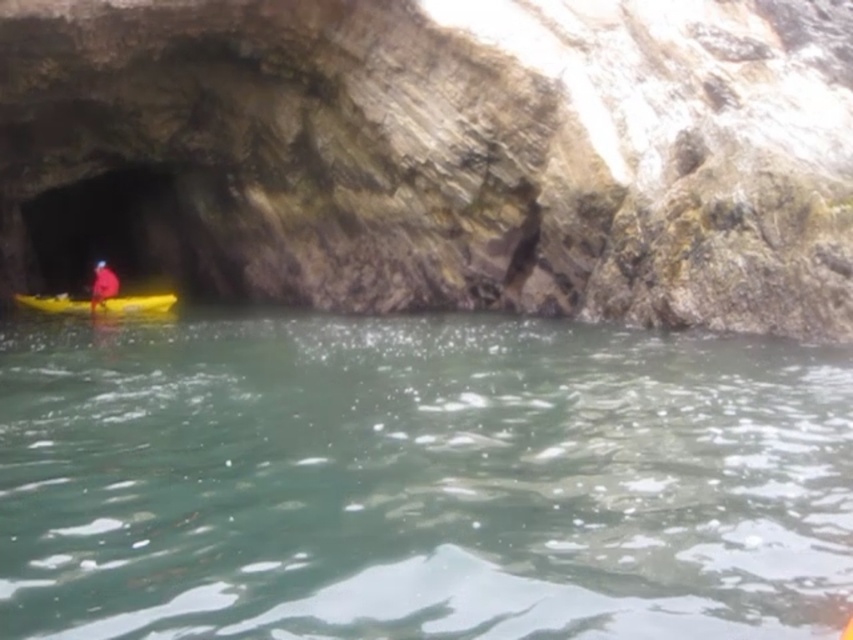
Can you confirm if rough stone cave at left is bigger than red fabric person at left?

Correct, rough stone cave at left is larger in size than red fabric person at left.

Is rough stone cave at left thinner than red fabric person at left?

In fact, rough stone cave at left might be wider than red fabric person at left.

Measure the distance between point (538,253) and camera.

Point (538,253) is 61.72 feet away from camera.

You are a GUI agent. You are given a task and a screenshot of the screen. Output one action in this format:
    pyautogui.click(x=<x>, y=<y>)
    Task: Click on the rough stone cave at left
    This screenshot has width=853, height=640.
    Given the screenshot: What is the action you would take?
    pyautogui.click(x=439, y=154)

Does point (480, 156) lie behind point (148, 307)?

No, (480, 156) is in front of (148, 307).

Where is `rough stone cave at left`? rough stone cave at left is located at coordinates (439, 154).

Who is positioned more to the left, yellow plastic canoe at left or red fabric person at left?

From the viewer's perspective, red fabric person at left appears more on the left side.

Does point (41, 301) lie in front of point (97, 301)?

No, it is behind (97, 301).

The height and width of the screenshot is (640, 853). I want to click on yellow plastic canoe at left, so click(100, 304).